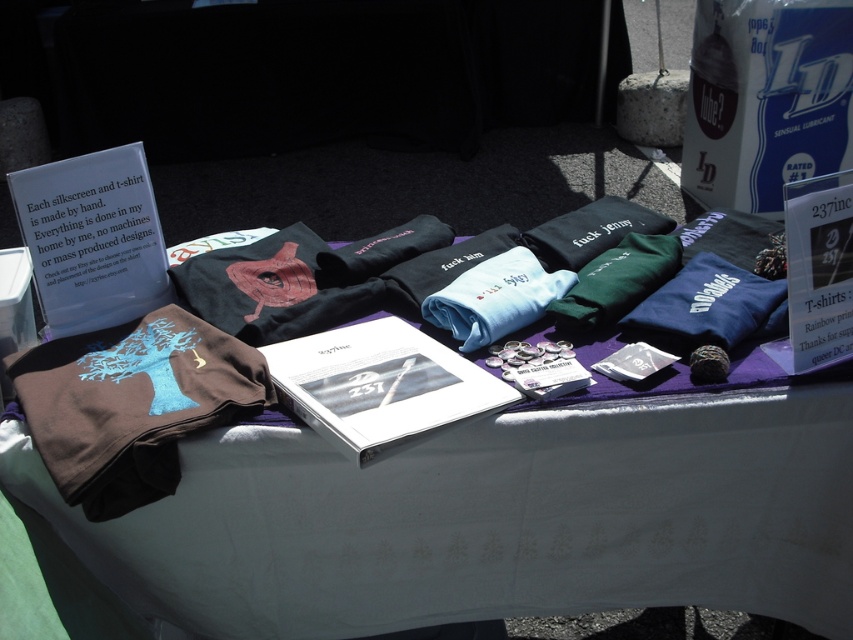
How much distance is there between brown cotton t-shirt at lower left and light blue cotton t-shirt at center?

A distance of 17.23 inches exists between brown cotton t-shirt at lower left and light blue cotton t-shirt at center.

Which is behind, point (129, 481) or point (496, 268)?

The point (496, 268) is more distant.

Locate an element on the screen. This screenshot has height=640, width=853. brown cotton t-shirt at lower left is located at coordinates (132, 403).